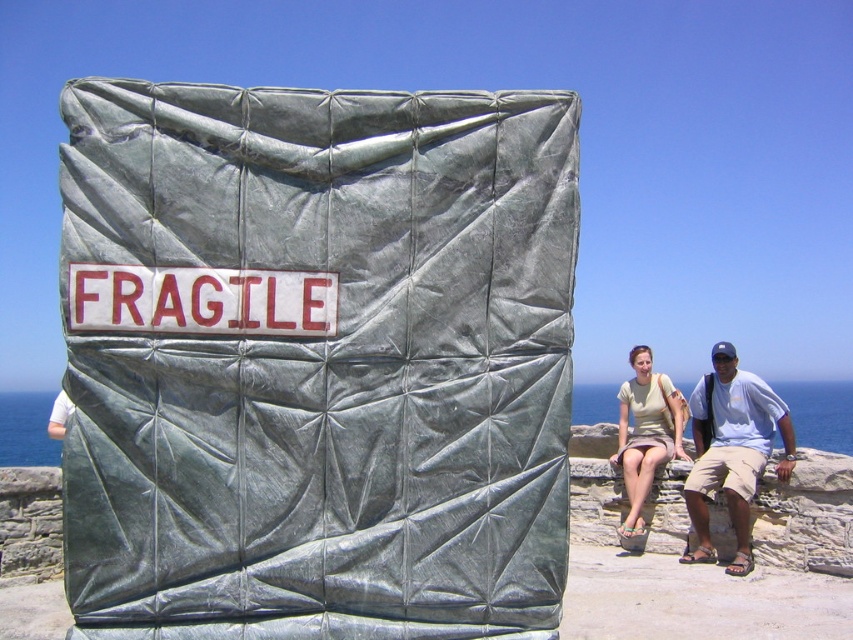
Question: Can you confirm if green tarp at center is smaller than light green cotton shirt at right?

Choices:
 (A) yes
 (B) no

Answer: (A)

Question: Which point appears closest to the camera in this image?

Choices:
 (A) (183, 221)
 (B) (131, 320)

Answer: (B)

Question: Estimate the real-world distances between objects in this image. Which object is closer to the green tarp at center?

Choices:
 (A) light green cotton shirt at right
 (B) white plastic sign at center
 (C) light blue cotton shirt at right

Answer: (B)

Question: Does white plastic sign at center have a larger size compared to light blue cotton shirt at right?

Choices:
 (A) no
 (B) yes

Answer: (A)

Question: Can you confirm if green tarp at center is wider than white plastic sign at center?

Choices:
 (A) no
 (B) yes

Answer: (A)

Question: Which point is farther from the camera taking this photo?

Choices:
 (A) (642, 410)
 (B) (703, 410)

Answer: (A)